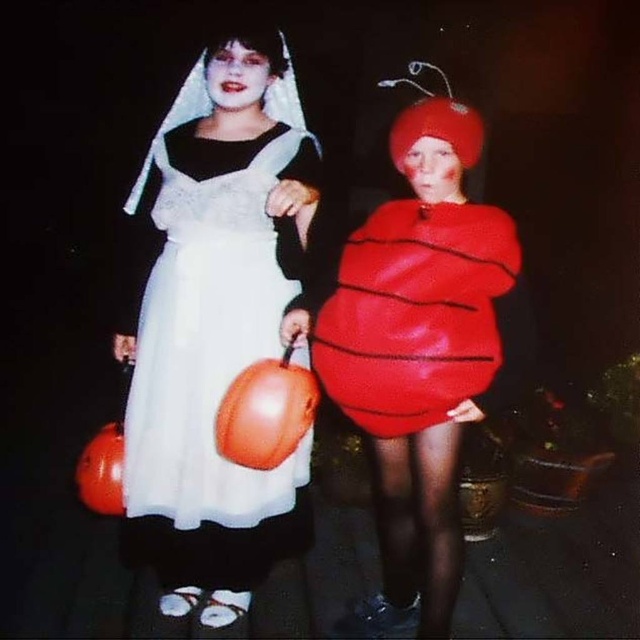
Question: Which of the following is the closest to the observer?

Choices:
 (A) (488, 353)
 (B) (444, 170)

Answer: (A)

Question: Is white satin dress at upper left positioned at the back of matte red costume at center?

Choices:
 (A) yes
 (B) no

Answer: (A)

Question: Where is white satin dress at upper left located in relation to rubberized red apple at center in the image?

Choices:
 (A) below
 (B) above

Answer: (A)

Question: Which object appears farthest from the camera in this image?

Choices:
 (A) white satin dress at upper left
 (B) rubberized red apple at center
 (C) matte red costume at center

Answer: (A)

Question: Does matte red costume at center appear on the right side of rubberized red apple at center?

Choices:
 (A) no
 (B) yes

Answer: (A)

Question: Which point is closer to the camera?

Choices:
 (A) (381, 397)
 (B) (340, 349)

Answer: (A)